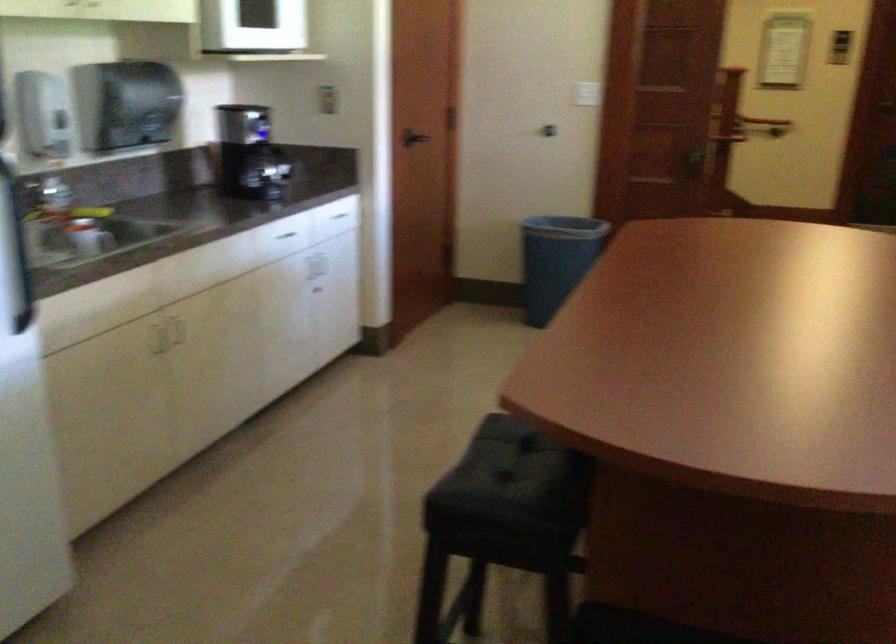
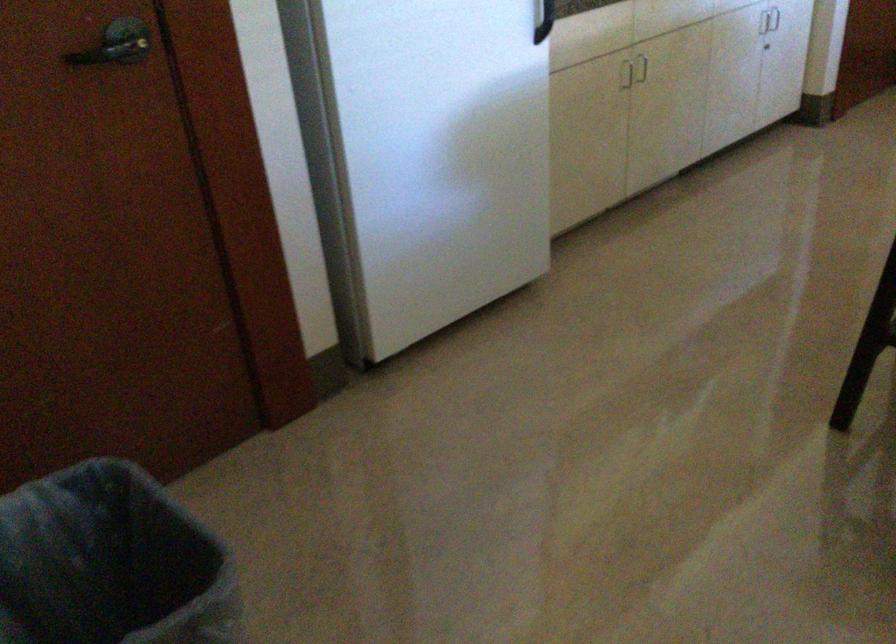
The point at (141, 341) is marked in the first image. Where is the corresponding point in the second image?

(625, 75)